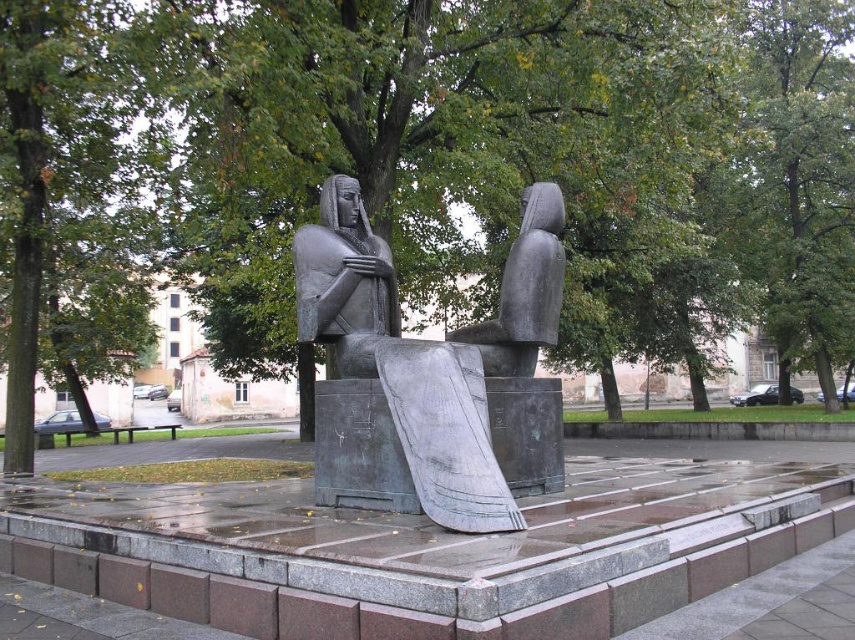
You are standing in front of the sculpture and want to touch both points. Which point should you reach for first, the point at coordinate (219, 86) or the point at coordinate (434, 518)?

You should reach for point (219, 86) first because it is closer to you than point (434, 518).